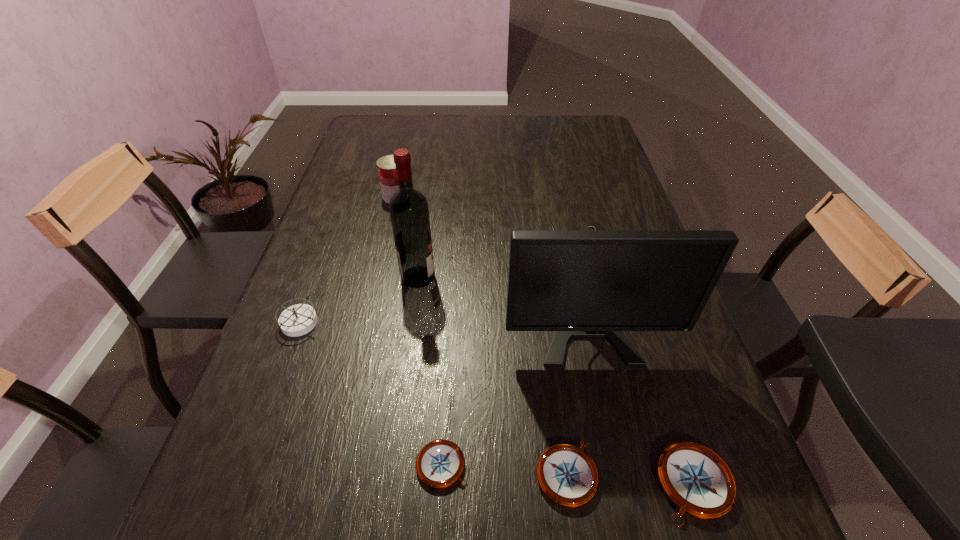
Image resolution: width=960 pixels, height=540 pixels. In order to click on compass situated at the left edge in this screenshot , I will do `click(297, 320)`.

The image size is (960, 540). What are the coordinates of `compass that is at the right edge` in the screenshot? It's located at (697, 480).

Identify the location of computer monitor that is at the right edge. Image resolution: width=960 pixels, height=540 pixels. (579, 283).

Identify the location of object that is at the near right corner. This screenshot has height=540, width=960. (697, 480).

Image resolution: width=960 pixels, height=540 pixels. Find the location of `vacant space at the far edge of the desktop`. vacant space at the far edge of the desktop is located at coordinates (523, 119).

This screenshot has height=540, width=960. Find the location of `blank area at the left edge`. blank area at the left edge is located at coordinates (340, 179).

The width and height of the screenshot is (960, 540). Find the location of `vacant area at the right edge of the desktop`. vacant area at the right edge of the desktop is located at coordinates (673, 422).

This screenshot has width=960, height=540. In order to click on free space at the far right corner in this screenshot , I will do `click(583, 145)`.

Identify the location of vacant point at the near right corner. The image size is (960, 540). (662, 450).

You are a GUI agent. You are given a task and a screenshot of the screen. Output one action in this format:
    pyautogui.click(x=<x>, y=<y>)
    Task: Click on the free space between the leftmost object and the fifth tallest object
    The height and width of the screenshot is (540, 960).
    Given the screenshot: What is the action you would take?
    pyautogui.click(x=497, y=403)